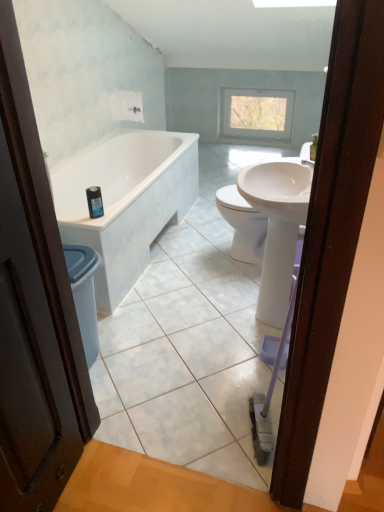
Question: In terms of width, does blue glossy bottle at upper left look wider or thinner when compared to white glossy sink at center?

Choices:
 (A) thin
 (B) wide

Answer: (A)

Question: From a real-world perspective, relative to white glossy sink at center, is blue glossy bottle at upper left vertically above or below?

Choices:
 (A) above
 (B) below

Answer: (A)

Question: Estimate the real-world distances between objects in this image. Which object is farther from the blue glossy bottle at upper left?

Choices:
 (A) clear glass window at upper center
 (B) white glossy sink at center
 (C) white glossy bathtub at left

Answer: (A)

Question: Which is nearer to the white glossy bathtub at left?

Choices:
 (A) clear glass window at upper center
 (B) white glossy sink at center
 (C) blue glossy bottle at upper left

Answer: (C)